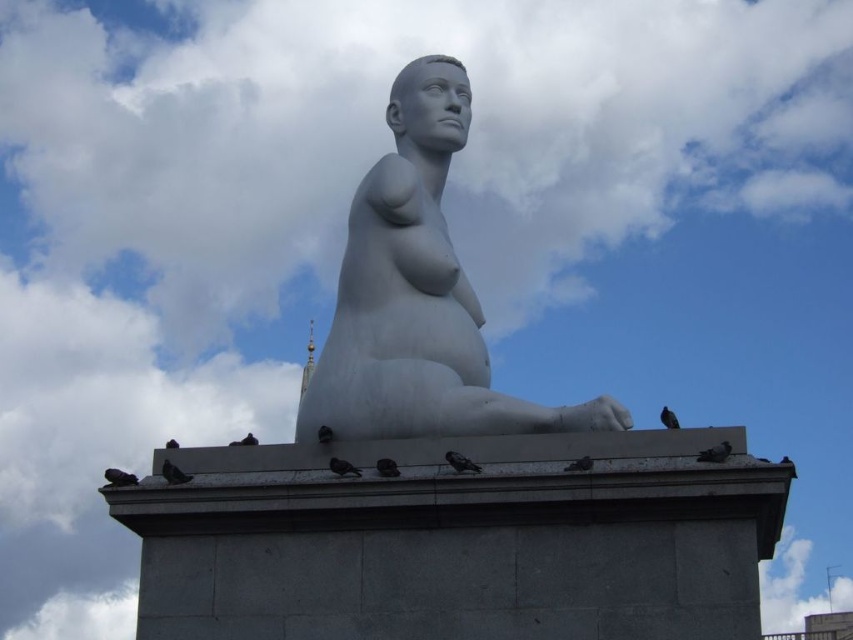
You are standing in front of the statue and want to take a photo that includes both the point at coordinates point (109, 476) and point (357, 474). Which point will appear closer to the camera in your photo?

Point (109, 476) is further to the camera than point (357, 474), so in the photo, point (109, 476) will appear closer to the camera because it is physically closer to the camera.

You are a birdwatcher observing the statue and its surroundings. You notice dark gray feathers at lower left and a gray matte pigeon at lower center. Which object is positioned more to the left side of the image?

The dark gray feathers at lower left are positioned more to the left than the gray matte pigeon at lower center.